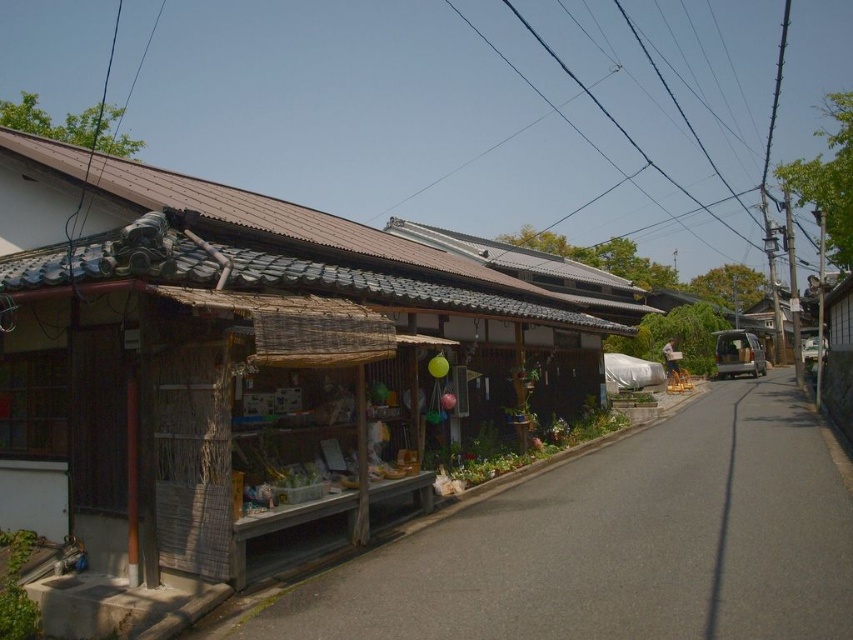
You are standing in front of the wooden stall at lower left and want to take a photo of it with your smartphone. The stall is 15.02 feet away from you. Your smartphone has a standard camera that can focus clearly on objects between 1 foot and 10 feet away. Will the photo be in focus?

The wooden stall at lower left is 15.02 feet away from the camera, which is beyond the smartphone camera focus range of 1 to 10 feet. Therefore, the photo may not be in focus.

You are standing at the entrance of the wooden hut at center. If you walk straight ahead, will you be facing the bicycle that is visible in the distance?

The wooden hut at center is located at point (244, 360). Since the street runs parallel to the building and the bicycle is visible in the distance along the street, walking straight ahead from the entrance would align with the direction of the street, so yes, you would be facing the bicycle that is visible in the distance.

You are a delivery person trying to park your electric scooter. You see the wooden stall at lower left and the black wire at upper center. Which object is closer to the left side of the street?

The wooden stall at lower left is closer to the left side of the street because it is positioned to the left of the black wire at upper center.